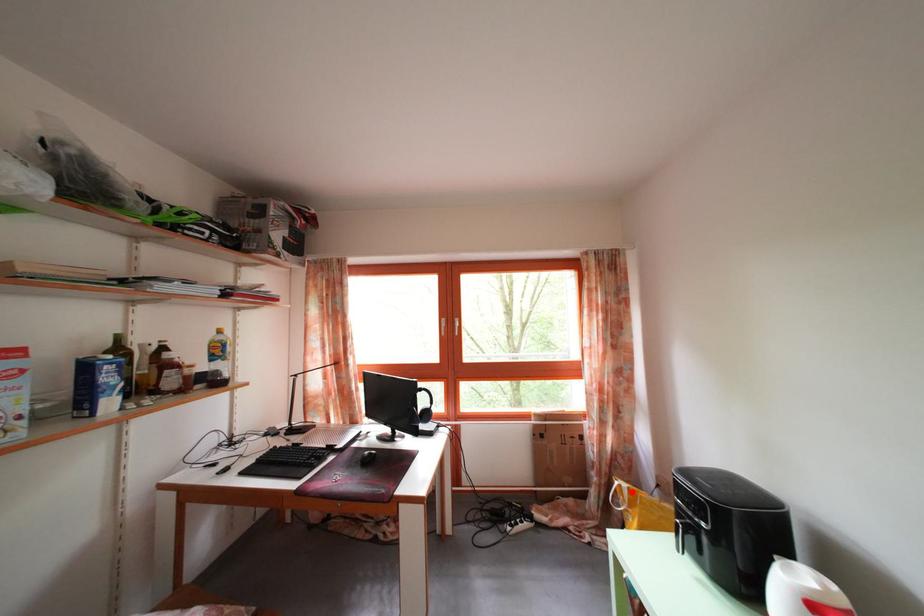
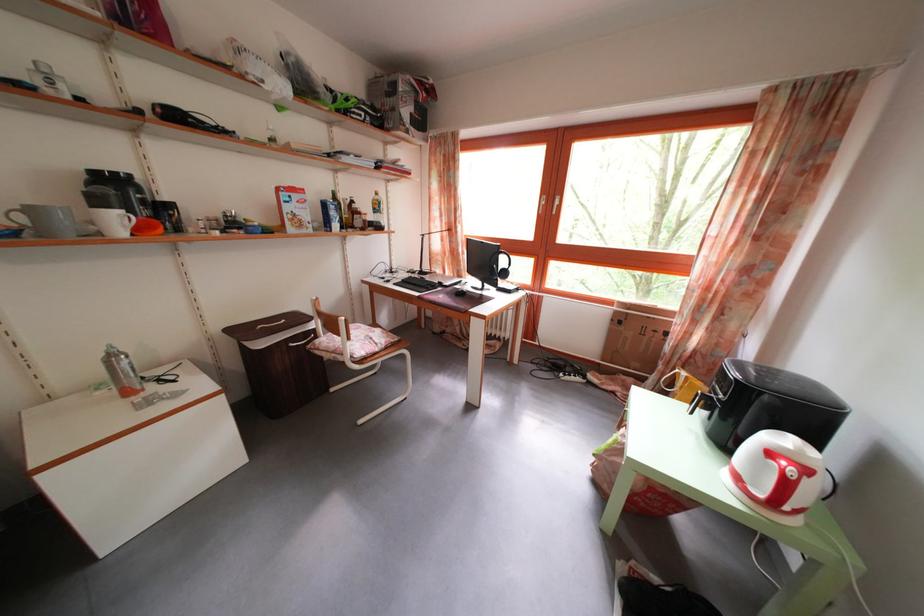
Find the pixel in the second image that matches the highlighted location in the first image.

(691, 381)